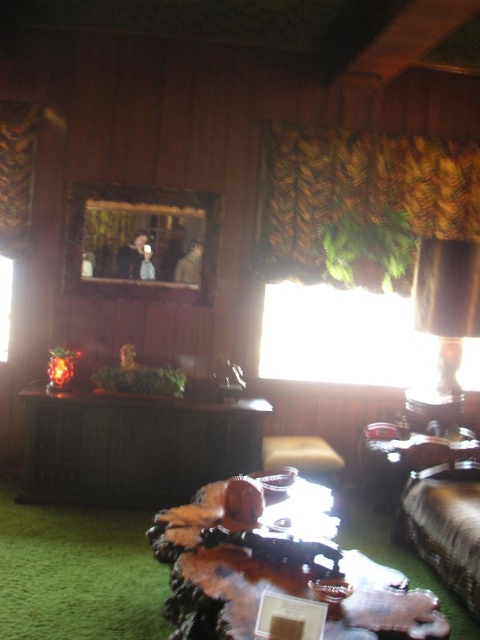
Question: Which point is farther from the camera taking this photo?

Choices:
 (A) (320, 515)
 (B) (347, 256)
 (C) (474, 528)
 (D) (332, 476)

Answer: (B)

Question: Can you confirm if wooden table at center is smaller than green leafy fabric at upper right?

Choices:
 (A) yes
 (B) no

Answer: (B)

Question: Estimate the real-world distances between objects in this image. Which object is closer to the matte brown lampshade at upper right?

Choices:
 (A) wooden table at center
 (B) dark wood cabinet at center
 (C) green leafy fabric at upper right

Answer: (C)

Question: Which object is closer to the camera taking this photo?

Choices:
 (A) matte brown lampshade at upper right
 (B) velvet brown couch at lower right

Answer: (B)

Question: Does wooden table at center appear on the left side of velvet brown couch at lower right?

Choices:
 (A) yes
 (B) no

Answer: (A)

Question: Can you confirm if matte brown lampshade at upper right is thinner than brown leather stool at center?

Choices:
 (A) yes
 (B) no

Answer: (A)